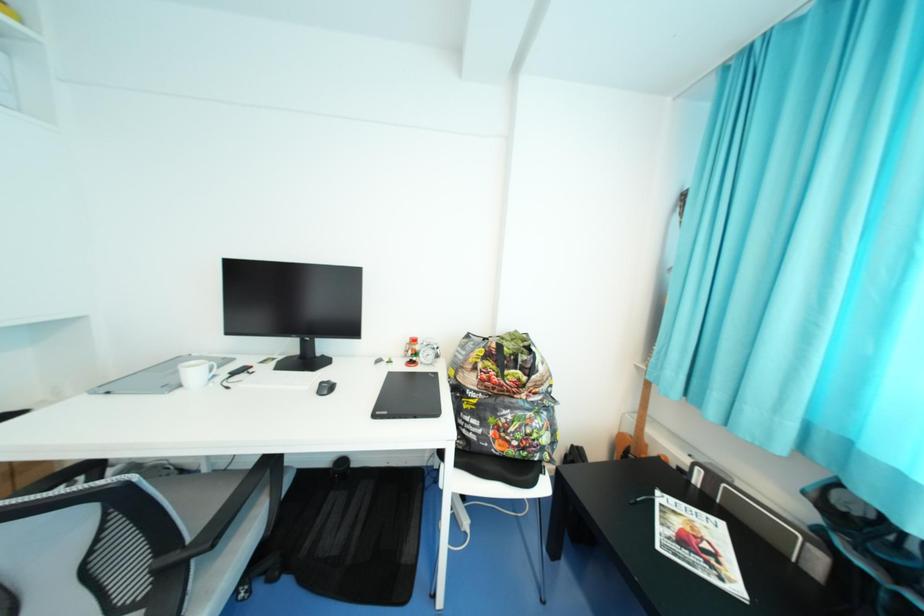
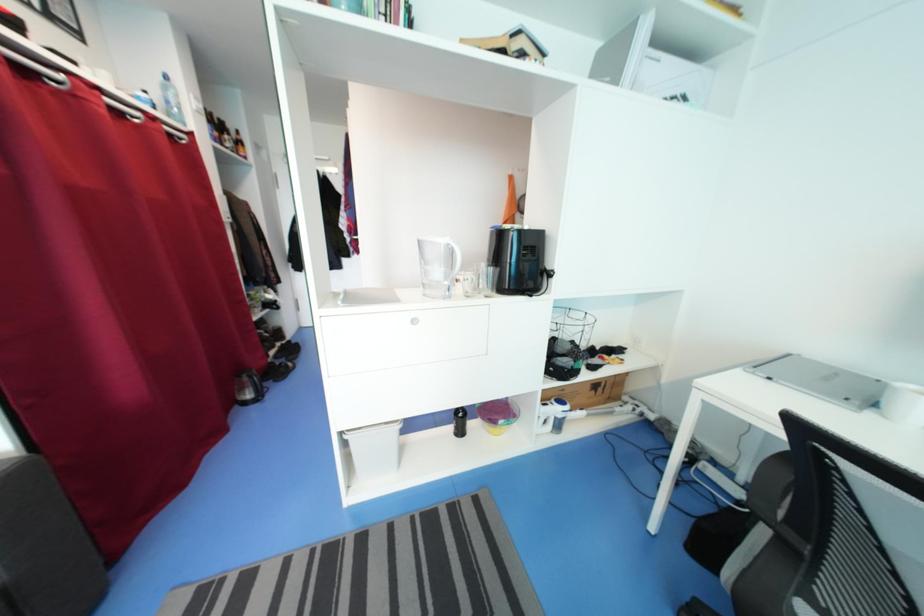
Question: The first image is from the beginning of the video and the second image is from the end. How did the camera likely rotate when shooting the video?

Choices:
 (A) Left
 (B) Right
 (C) Up
 (D) Down

Answer: (A)